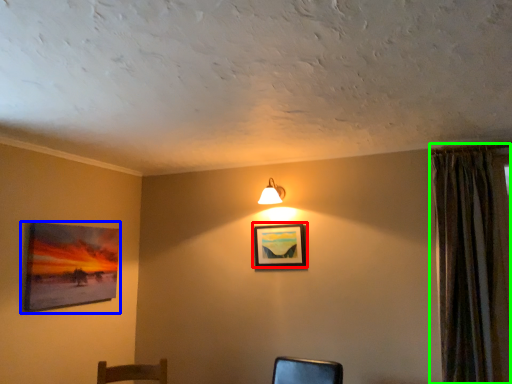
Question: Which object is positioned closest to picture frame (highlighted by a red box)? Select from picture frame (highlighted by a blue box) and curtain (highlighted by a green box).

Choices:
 (A) picture frame
 (B) curtain

Answer: (B)